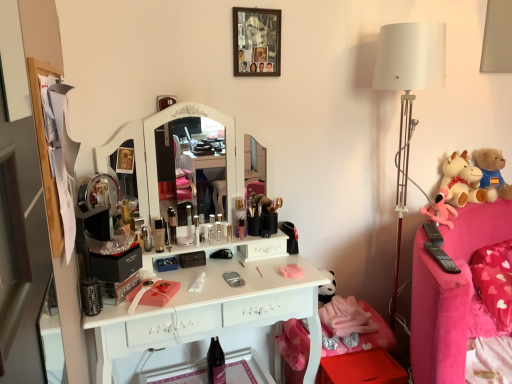
Question: Is pink fabric swivel chair at lower right facing away from white plush cow at right, which appears as the 2th toy when viewed from the left?

Choices:
 (A) yes
 (B) no

Answer: (B)

Question: Is pink fabric swivel chair at lower right positioned far away from white plush cow at right, the second toy viewed from the right?

Choices:
 (A) yes
 (B) no

Answer: (B)

Question: Does pink fabric swivel chair at lower right lie behind white plush cow at right, the second toy viewed from the right?

Choices:
 (A) yes
 (B) no

Answer: (B)

Question: Considering the relative sizes of pink fabric swivel chair at lower right and white plush cow at right, which appears as the 2th toy when viewed from the left, in the image provided, is pink fabric swivel chair at lower right taller than white plush cow at right, which appears as the 2th toy when viewed from the left,?

Choices:
 (A) no
 (B) yes

Answer: (A)

Question: Is pink fabric swivel chair at lower right outside of white plush cow at right, which appears as the 2th toy when viewed from the left?

Choices:
 (A) no
 (B) yes

Answer: (B)

Question: From a real-world perspective, is pink fabric swivel chair at lower right under white plush cow at right, which appears as the 2th toy when viewed from the left?

Choices:
 (A) no
 (B) yes

Answer: (B)

Question: From a real-world perspective, is pink fabric plush at right, marked as the 1th toy in a left-to-right arrangement, on matte black lipstick at center, the fourth toiletry positioned from the right?

Choices:
 (A) no
 (B) yes

Answer: (B)

Question: Is pink fabric plush at right, the third toy in the right-to-left sequence, aimed at matte black lipstick at center, arranged as the third toiletry when viewed from the left?

Choices:
 (A) no
 (B) yes

Answer: (A)

Question: Is pink fabric plush at right, marked as the 1th toy in a left-to-right arrangement, further to the viewer compared to matte black lipstick at center, the fourth toiletry positioned from the right?

Choices:
 (A) no
 (B) yes

Answer: (B)

Question: From a real-world perspective, is pink fabric plush at right, the third toy in the right-to-left sequence, beneath matte black lipstick at center, the fourth toiletry positioned from the right?

Choices:
 (A) no
 (B) yes

Answer: (A)

Question: From the image's perspective, is pink fabric plush at right, marked as the 1th toy in a left-to-right arrangement, below matte black lipstick at center, arranged as the third toiletry when viewed from the left?

Choices:
 (A) no
 (B) yes

Answer: (A)

Question: Can you confirm if pink fabric plush at right, marked as the 1th toy in a left-to-right arrangement, is taller than matte black lipstick at center, the fourth toiletry positioned from the right?

Choices:
 (A) no
 (B) yes

Answer: (B)

Question: Does pink fabric plush at right, marked as the 1th toy in a left-to-right arrangement, appear on the right side of pink fabric swivel chair at lower right?

Choices:
 (A) yes
 (B) no

Answer: (A)